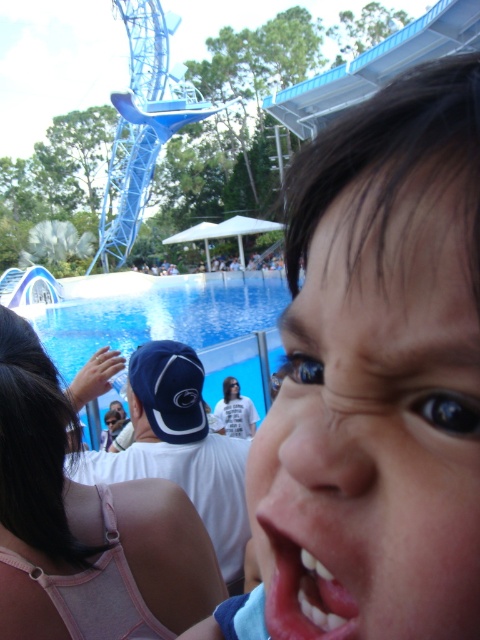
Question: From the image, what is the correct spatial relationship of pink fabric at center in relation to transparent glass pool at center?

Choices:
 (A) below
 (B) above

Answer: (A)

Question: Which object is the farthest from the transparent glass pool at center?

Choices:
 (A) pink glossy lips at center
 (B) pink fabric at center
 (C) smooth skin face at center

Answer: (A)

Question: Which point is closer to the camera?

Choices:
 (A) (200, 582)
 (B) (260, 388)
 (C) (301, 532)
 (D) (299, 616)

Answer: (C)

Question: Which object is the closest to the pink glossy lips at center?

Choices:
 (A) pink fabric at center
 (B) smooth skin face at center
 (C) transparent glass pool at center

Answer: (B)

Question: Can you confirm if pink fabric at center is positioned below pink glossy lips at center?

Choices:
 (A) no
 (B) yes

Answer: (A)

Question: Does smooth skin face at center appear under pink fabric at center?

Choices:
 (A) no
 (B) yes

Answer: (A)